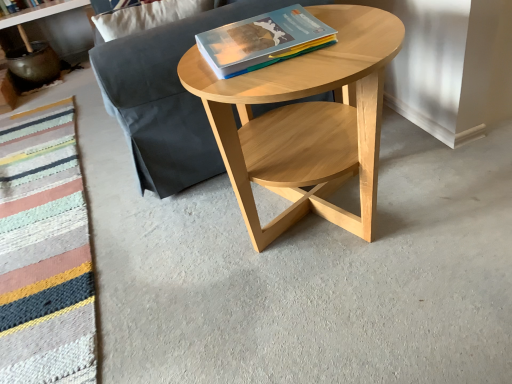
Describe the element at coordinates (263, 41) in the screenshot. I see `matte paper book at center` at that location.

What do you see at coordinates (40, 12) in the screenshot?
I see `matte white shelf at upper left` at bounding box center [40, 12].

Where is `matte paper book at center`? matte paper book at center is located at coordinates (263, 41).

Does natural wood coffee table at center have a larger size compared to matte white shelf at upper left?

Yes.

Who is shorter, natural wood coffee table at center or matte white shelf at upper left?

matte white shelf at upper left.

Is natural wood coffee table at center oriented towards matte white shelf at upper left?

No.

In terms of width, does natural wood coffee table at center look wider or thinner when compared to matte white shelf at upper left?

In the image, natural wood coffee table at center appears to be wider than matte white shelf at upper left.

Is matte white shelf at upper left with natural wood coffee table at center?

No, matte white shelf at upper left is not in contact with natural wood coffee table at center.

Can you tell me how much matte white shelf at upper left and natural wood coffee table at center differ in facing direction?

matte white shelf at upper left and natural wood coffee table at center are facing 90.4 degrees away from each other.

Could you tell me if matte white shelf at upper left is turned towards natural wood coffee table at center?

Yes.

At what (x,y) coordinates should I click in order to perform the action: click on shelf that appears behind the natural wood coffee table at center. Please return your answer as a coordinate pair (x, y). The height and width of the screenshot is (384, 512). Looking at the image, I should click on (40, 12).

Would you say knitted wool blanket at lower left is part of natural wood coffee table at center's contents?

No, knitted wool blanket at lower left is not a part of natural wood coffee table at center.

Which point is more forward, (x=226, y=90) or (x=34, y=200)?

Point (x=226, y=90)

Can you confirm if natural wood coffee table at center is bigger than knitted wool blanket at lower left?

Indeed, natural wood coffee table at center has a larger size compared to knitted wool blanket at lower left.

Considering the points (16, 24) and (293, 35), which point is behind, point (16, 24) or point (293, 35)?

The point (16, 24) is farther from the camera.

Is matte white shelf at upper left facing away from matte paper book at center?

No, matte paper book at center is not at the back of matte white shelf at upper left.

Is matte paper book at center located within matte white shelf at upper left?

No, matte white shelf at upper left does not contain matte paper book at center.

From a real-world perspective, is matte paper book at center on top of knitted wool blanket at lower left?

Yes, from a real-world perspective, matte paper book at center is on top of knitted wool blanket at lower left.

Does point (300, 17) appear closer or farther from the camera than point (22, 358)?

Clearly, point (300, 17) is more distant from the camera than point (22, 358).

Between matte paper book at center and knitted wool blanket at lower left, which one has smaller width?

Thinner between the two is matte paper book at center.

Is knitted wool blanket at lower left at the back of matte paper book at center?

No, matte paper book at center is not facing the opposite direction of knitted wool blanket at lower left.

From a real-world perspective, who is located lower, matte white shelf at upper left or knitted wool blanket at lower left?

knitted wool blanket at lower left.

Is point (87, 1) positioned in front of point (50, 290)?

No, it is not.

Which of these two, matte white shelf at upper left or knitted wool blanket at lower left, is thinner?

matte white shelf at upper left.

From the image's perspective, which one is positioned higher, matte paper book at center or dark gray fabric couch at center?

dark gray fabric couch at center.

Is point (298, 34) closer or farther from the camera than point (140, 117)?

Point (298, 34) appears to be closer to the viewer than point (140, 117).

Which object is further away from the camera taking this photo, matte paper book at center or dark gray fabric couch at center?

Positioned behind is dark gray fabric couch at center.

Does matte paper book at center have a smaller size compared to dark gray fabric couch at center?

Indeed, matte paper book at center has a smaller size compared to dark gray fabric couch at center.

Image resolution: width=512 pixels, height=384 pixels. Find the location of `shelf behind the natural wood coffee table at center`. shelf behind the natural wood coffee table at center is located at coordinates (40, 12).

Where is `shelf above the natural wood coffee table at center (from the image's perspective)`? The image size is (512, 384). shelf above the natural wood coffee table at center (from the image's perspective) is located at coordinates (40, 12).

Looking at the image, which one is located closer to matte paper book at center, dark gray fabric couch at center or matte white shelf at upper left?

dark gray fabric couch at center is positioned closer to the anchor matte paper book at center.

Considering their positions, is matte paper book at center positioned closer to dark gray fabric couch at center than natural wood coffee table at center?

natural wood coffee table at center lies closer to dark gray fabric couch at center than the other object.

Looking at the image, which one is located closer to knitted wool blanket at lower left, dark gray fabric couch at center or matte paper book at center?

dark gray fabric couch at center.

Estimate the real-world distances between objects in this image. Which object is further from natural wood coffee table at center, matte paper book at center or matte white shelf at upper left?

matte white shelf at upper left.

Considering their positions, is natural wood coffee table at center positioned closer to matte white shelf at upper left than matte paper book at center?

matte paper book at center is positioned closer to the anchor matte white shelf at upper left.

Looking at the image, which one is located closer to matte paper book at center, knitted wool blanket at lower left or dark gray fabric couch at center?

The object closer to matte paper book at center is dark gray fabric couch at center.

Considering their positions, is natural wood coffee table at center positioned closer to knitted wool blanket at lower left than matte paper book at center?

Based on the image, natural wood coffee table at center appears to be nearer to knitted wool blanket at lower left.

Looking at the image, which one is located further to knitted wool blanket at lower left, matte paper book at center or natural wood coffee table at center?

matte paper book at center.

This screenshot has width=512, height=384. Find the location of `blanket located between matte paper book at center and matte white shelf at upper left in the depth direction`. blanket located between matte paper book at center and matte white shelf at upper left in the depth direction is located at coordinates (44, 251).

Where is `couch located between natural wood coffee table at center and matte white shelf at upper left in the depth direction`? couch located between natural wood coffee table at center and matte white shelf at upper left in the depth direction is located at coordinates (167, 97).

What are the coordinates of `blanket positioned between natural wood coffee table at center and matte white shelf at upper left from near to far` in the screenshot? It's located at (44, 251).

In order to click on book between knitted wool blanket at lower left and natural wood coffee table at center from left to right in this screenshot , I will do `click(263, 41)`.